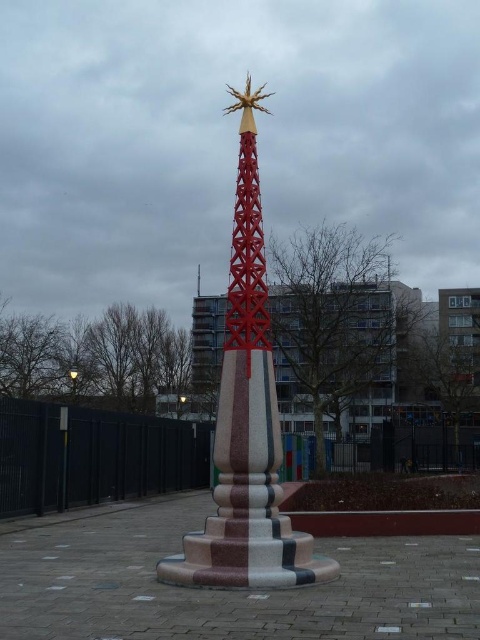
Question: Which object appears closest to the camera in this image?

Choices:
 (A) marble-patterned column at center
 (B) red painted metal spire at center

Answer: (A)

Question: Can you confirm if marble-patterned column at center is positioned to the right of red painted metal spire at center?

Choices:
 (A) no
 (B) yes

Answer: (B)

Question: Is marble-patterned column at center below red painted metal spire at center?

Choices:
 (A) no
 (B) yes

Answer: (B)

Question: Can you confirm if marble-patterned column at center is positioned to the left of red painted metal spire at center?

Choices:
 (A) yes
 (B) no

Answer: (B)